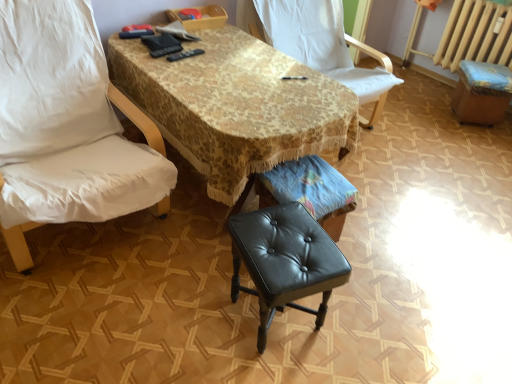
Identify the location of free point to the left of black leather stool at center. The height and width of the screenshot is (384, 512). (194, 310).